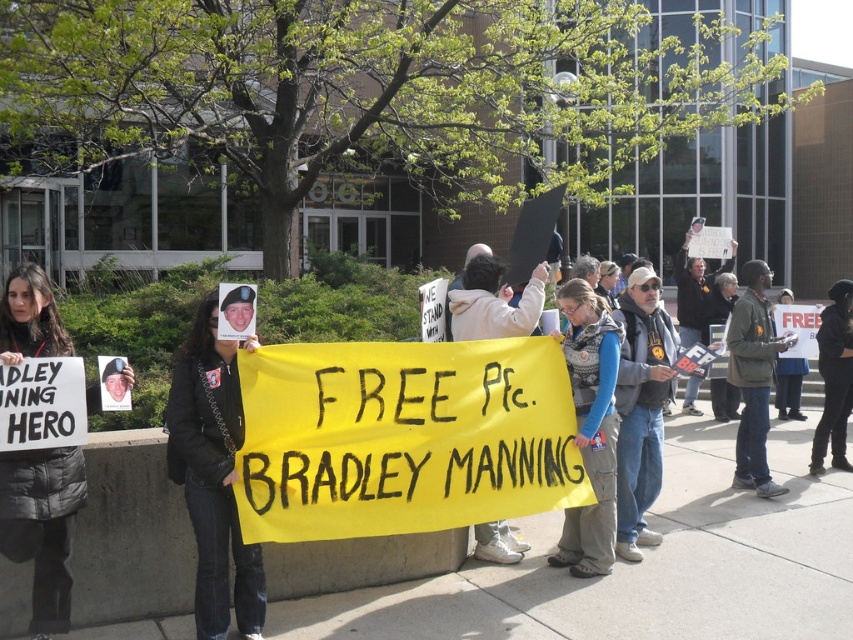
You are a photographer trying to capture the protest scene. You notice the black leather jacket at center. Where exactly is it positioned in the image?

The black leather jacket at center is located at point (213, 474) in the image coordinates.

You are a photographer trying to capture the protest scene. You want to focus on the denim jacket at center. Based on its coordinates, where should you aim your camera?

The denim jacket at center is located at coordinates point (x=590, y=428), so aim your camera there to focus on it.

You are a photographer at the protest scene. You need to capture a photo that includes both the black leather jacket at center and the denim jacket at center. Which jacket will appear taller in the photo?

The denim jacket at center is taller than the black leather jacket at center, so the denim jacket will appear taller in the photo.